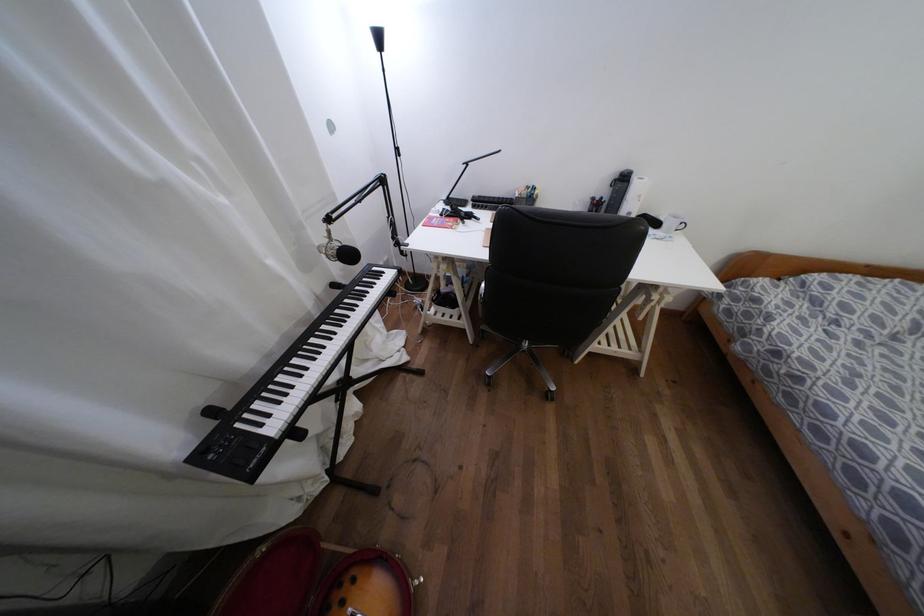
The location [379,38] corresponds to which object?

This point indicates the black desk lamp.